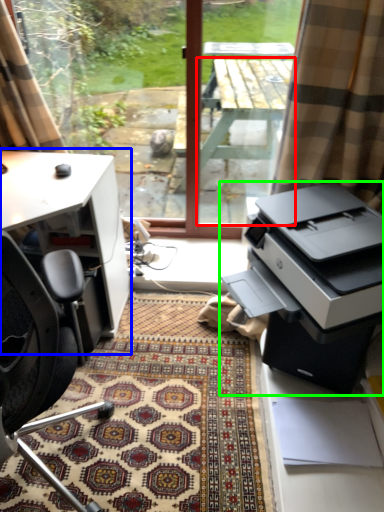
Question: Which object is the farthest from table (highlighted by a red box)? Choose among these: desk (highlighted by a blue box) or printer (highlighted by a green box).

Choices:
 (A) desk
 (B) printer

Answer: (B)